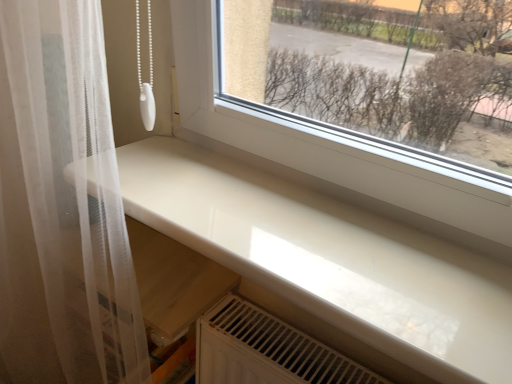
The image size is (512, 384). Describe the element at coordinates (330, 259) in the screenshot. I see `white glossy window sill at center` at that location.

Where is `white glossy window sill at center`? Image resolution: width=512 pixels, height=384 pixels. white glossy window sill at center is located at coordinates (330, 259).

This screenshot has height=384, width=512. In order to click on white glossy window sill at center in this screenshot , I will do `click(330, 259)`.